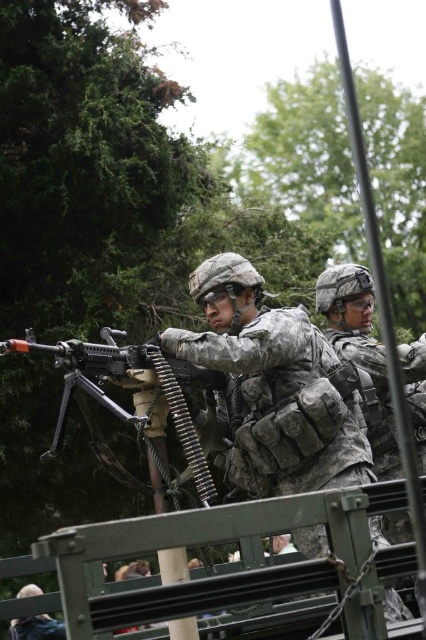
You are a drone operator controlling a drone that has a minimum safe distance of 12 feet from objects to avoid collision. You need to fly the drone towards the camouflage fabric helmet at center. Based on the given information, is it safe to fly the drone at its current distance?

The camouflage fabric helmet at center is 13.09 feet away from the viewer. Since the minimum safe distance is 12 feet, the drone can safely fly at this distance as it exceeds the required safety margin.

Looking at this image, you are a military analyst assessing the positioning of soldiers in the image. The point marked at coordinates (273,387) is part of an object in the scene. Which object does this point belong to?

The point at coordinates (273,387) corresponds to the camouflage fabric uniform at center.

Looking at this image, you are a military equipment inspector checking the dimensions of the gear. The camouflage fabric helmet at center and the camouflage uniform at lower left are both in front of you. Which item has a smaller width according to the description?

The camouflage fabric helmet at center has a smaller width than the camouflage uniform at lower left.